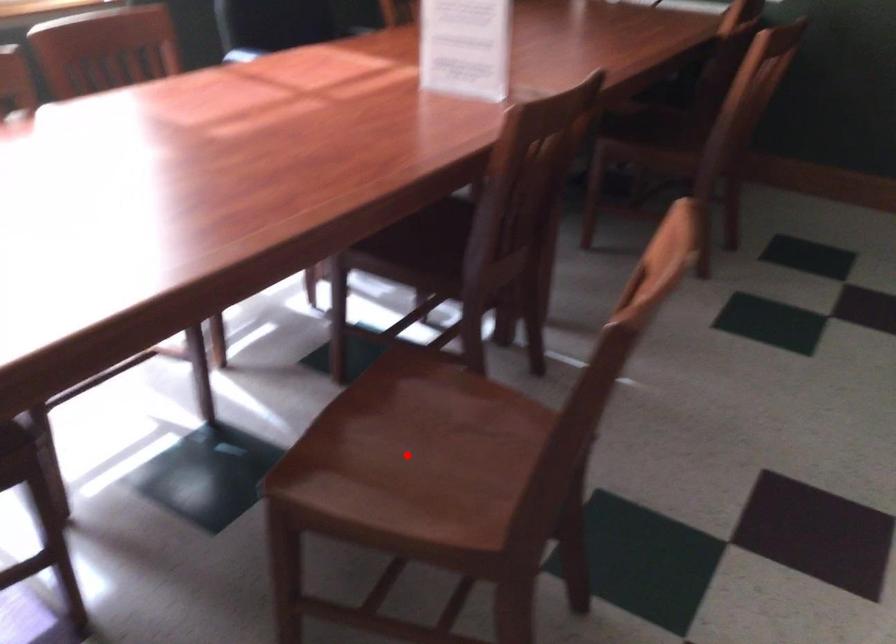
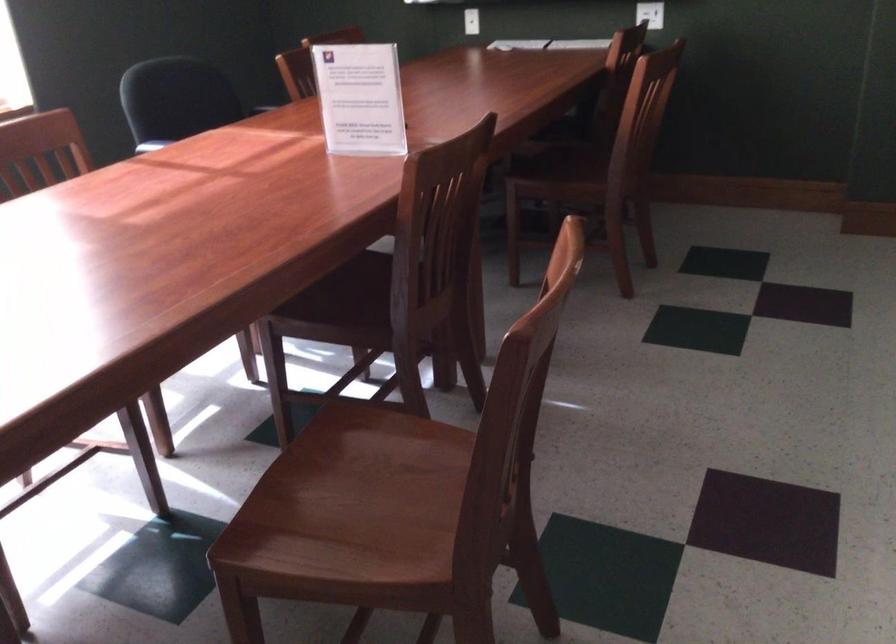
Locate, in the second image, the point that corresponds to the highlighted location in the first image.

(351, 504)